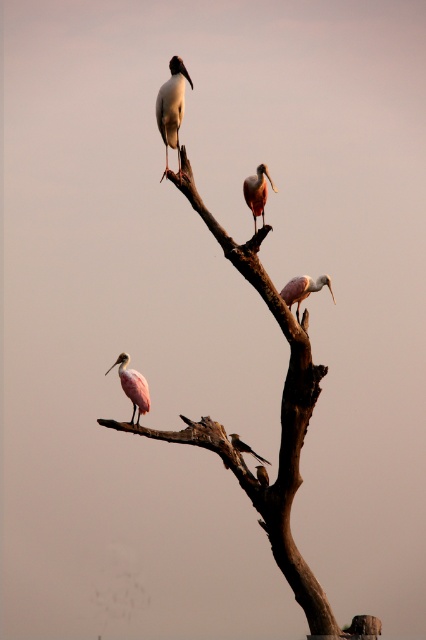
Is pink feathered spoonbill at center to the right of smooth pink spoonbill at lower center from the viewer's perspective?

Correct, you'll find pink feathered spoonbill at center to the right of smooth pink spoonbill at lower center.

Who is more distant from viewer, (305,291) or (261,481)?

Point (305,291)

Which is behind, point (296, 301) or point (259, 468)?

The point (296, 301) is behind.

What are the coordinates of `pink feathered spoonbill at center` in the screenshot? It's located at (302, 289).

Which is below, pink feathered bird at lower center or smooth pink spoonbill at lower center?

Positioned lower is smooth pink spoonbill at lower center.

Who is shorter, pink feathered bird at lower center or smooth pink spoonbill at lower center?

smooth pink spoonbill at lower center is shorter.

Measure the distance between point (x=241, y=449) and camera.

They are 266.49 feet apart.

What are the coordinates of `pink feathered bird at lower center` in the screenshot? It's located at (244, 448).

Is white glossy stork at upper center above pink matte spoonbill at upper center?

Indeed, white glossy stork at upper center is positioned over pink matte spoonbill at upper center.

In the scene shown: Between white glossy stork at upper center and pink matte spoonbill at upper center, which one appears on the right side from the viewer's perspective?

pink matte spoonbill at upper center

Locate an element on the screen. Image resolution: width=426 pixels, height=640 pixels. white glossy stork at upper center is located at coordinates (172, 108).